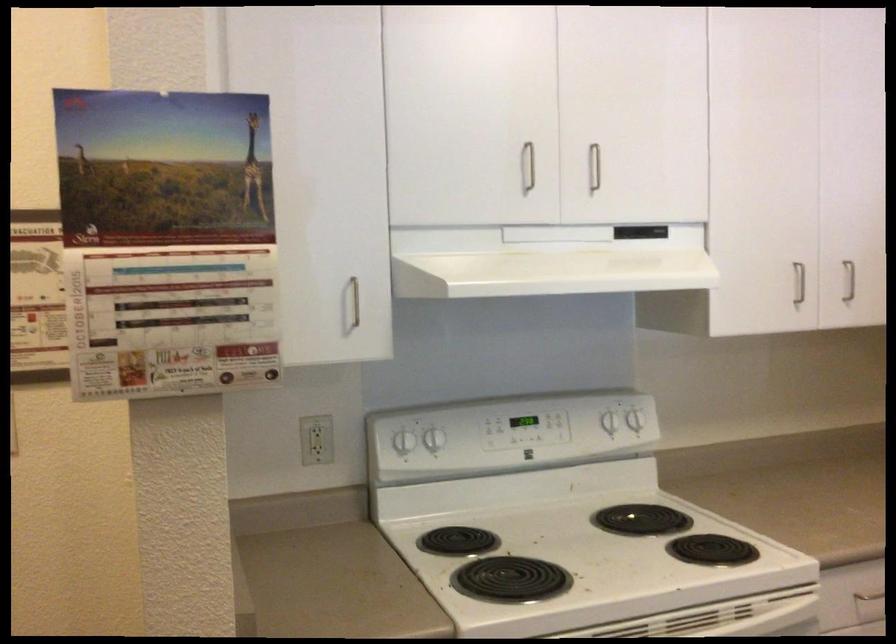
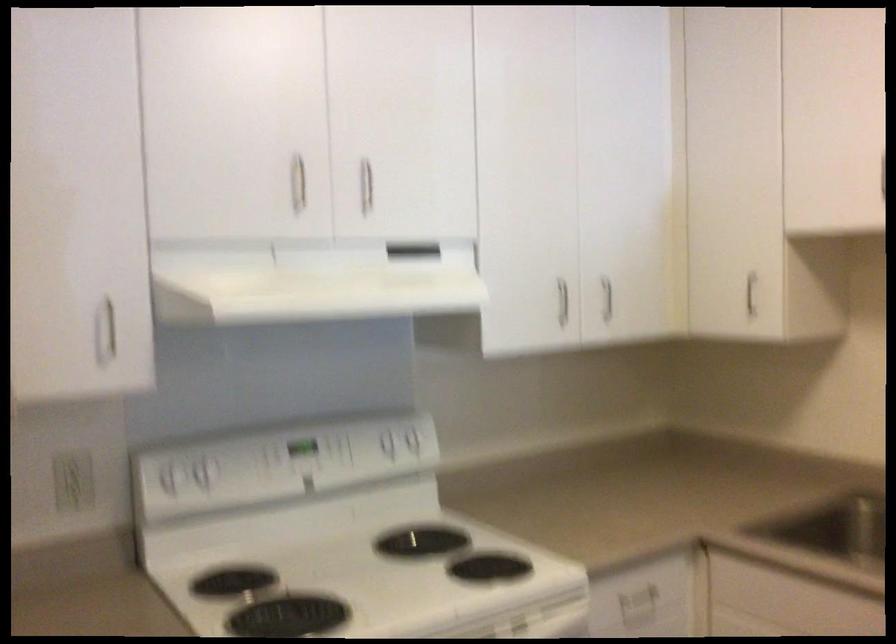
Find the pixel in the second image that matches [641,424] in the first image.

(419, 444)